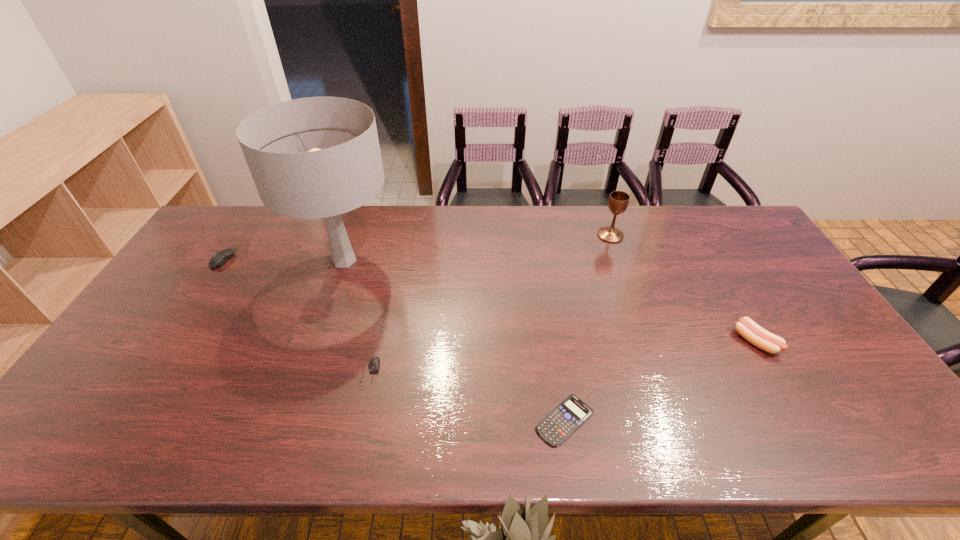
This screenshot has width=960, height=540. Identify the location of free space between the second object from right to left and the fourth shortest object. (683, 288).

Find the location of a particular element. The height and width of the screenshot is (540, 960). empty location between the fourth tallest object and the third object from right to left is located at coordinates (395, 340).

This screenshot has height=540, width=960. What are the coordinates of `free space between the nearest object and the second object from right to left` in the screenshot? It's located at (588, 328).

Find the location of `vacant region between the shortest object and the lampshade`. vacant region between the shortest object and the lampshade is located at coordinates (454, 340).

Locate an element on the screen. blank region between the fifth shortest object and the calculator is located at coordinates (588, 328).

Find the location of a particular element. vacant region between the left mouse and the nearer mouse is located at coordinates (298, 315).

Identify which object is the fourth nearest to the nearest object. Please provide its 2D coordinates. Your answer should be formatted as a tuple, i.e. [(x, y)], where the tuple contains the x and y coordinates of a point satisfying the conditions above.

[(618, 202)]

Identify which object is the second closest to the third tallest object. Please provide its 2D coordinates. Your answer should be formatted as a tuple, i.e. [(x, y)], where the tuple contains the x and y coordinates of a point satisfying the conditions above.

[(571, 413)]

You are a GUI agent. You are given a task and a screenshot of the screen. Output one action in this format:
    pyautogui.click(x=<x>, y=<y>)
    Task: Click on the vacant space that satisfies the following two spatial constraints: 1. on the front-facing side of the lampshade; 2. on the left side of the nearer mouse
    This screenshot has width=960, height=540.
    Given the screenshot: What is the action you would take?
    pyautogui.click(x=306, y=372)

Where is `vacant space that satisfies the following two spatial constraints: 1. on the front side of the chalice; 2. on the front-facing side of the tallest object`? This screenshot has height=540, width=960. vacant space that satisfies the following two spatial constraints: 1. on the front side of the chalice; 2. on the front-facing side of the tallest object is located at coordinates (619, 260).